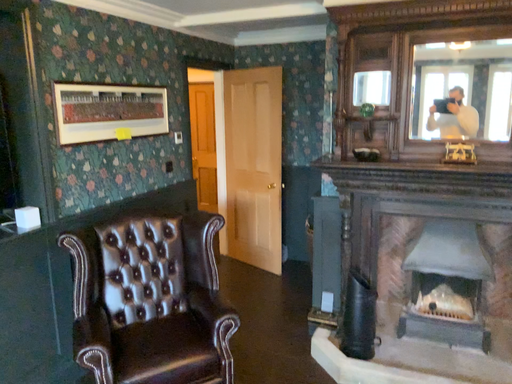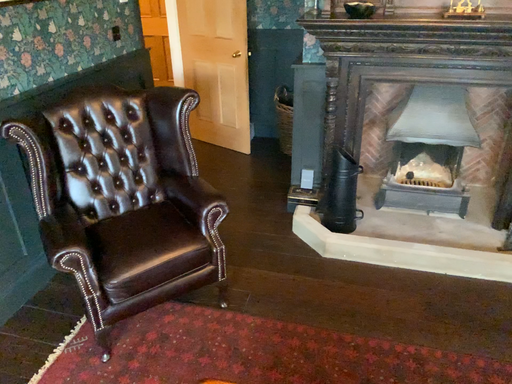
Question: Which way did the camera rotate in the video?

Choices:
 (A) rotated downward
 (B) rotated upward

Answer: (A)